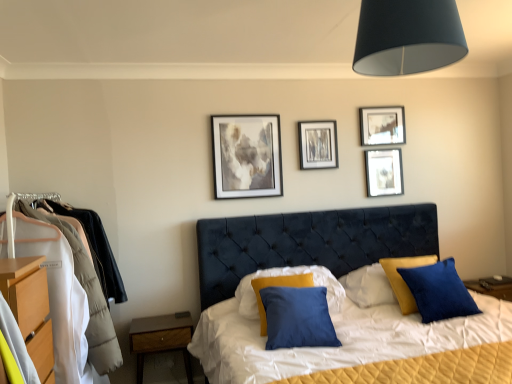
Question: Can you confirm if black matte lampshade at upper center is positioned to the left of matte silver picture frame at upper right, the 1th picture frame from the right?

Choices:
 (A) yes
 (B) no

Answer: (A)

Question: Does black matte lampshade at upper center lie in front of matte silver picture frame at upper right, the 1th picture frame from the right?

Choices:
 (A) no
 (B) yes

Answer: (B)

Question: Considering the relative sizes of black matte lampshade at upper center and matte silver picture frame at upper right, which is the fourth picture frame from left to right, in the image provided, is black matte lampshade at upper center smaller than matte silver picture frame at upper right, which is the fourth picture frame from left to right,?

Choices:
 (A) no
 (B) yes

Answer: (A)

Question: Is black matte lampshade at upper center thinner than matte silver picture frame at upper right, which is the fourth picture frame from left to right?

Choices:
 (A) yes
 (B) no

Answer: (B)

Question: Considering the relative sizes of black matte lampshade at upper center and matte silver picture frame at upper right, which is the fourth picture frame from left to right, in the image provided, is black matte lampshade at upper center bigger than matte silver picture frame at upper right, which is the fourth picture frame from left to right,?

Choices:
 (A) no
 (B) yes

Answer: (B)

Question: Can you confirm if black matte lampshade at upper center is shorter than matte silver picture frame at upper right, the 1th picture frame from the right?

Choices:
 (A) no
 (B) yes

Answer: (B)

Question: Would you say satin blue pillow at center, arranged as the 2th pillow when viewed from the right, is part of blue cotton pillow at center, the second pillow in the left-to-right sequence,'s contents?

Choices:
 (A) yes
 (B) no

Answer: (B)

Question: From a real-world perspective, is blue cotton pillow at center, which is the 1th pillow from right to left, under satin blue pillow at center, arranged as the 2th pillow when viewed from the right?

Choices:
 (A) yes
 (B) no

Answer: (A)

Question: Considering the relative positions of blue cotton pillow at center, which is the 1th pillow from right to left, and satin blue pillow at center, arranged as the 2th pillow when viewed from the right, in the image provided, is blue cotton pillow at center, which is the 1th pillow from right to left, to the right of satin blue pillow at center, arranged as the 2th pillow when viewed from the right, from the viewer's perspective?

Choices:
 (A) yes
 (B) no

Answer: (A)

Question: Is blue cotton pillow at center, which is the 1th pillow from right to left, in contact with satin blue pillow at center, arranged as the 2th pillow when viewed from the right?

Choices:
 (A) yes
 (B) no

Answer: (B)

Question: Considering the relative sizes of blue cotton pillow at center, which is the 1th pillow from right to left, and satin blue pillow at center, arranged as the 2th pillow when viewed from the right, in the image provided, is blue cotton pillow at center, which is the 1th pillow from right to left, thinner than satin blue pillow at center, arranged as the 2th pillow when viewed from the right,?

Choices:
 (A) yes
 (B) no

Answer: (A)

Question: Does blue cotton pillow at center, which is the 1th pillow from right to left, have a larger size compared to satin blue pillow at center, which appears as the 1th pillow when viewed from the left?

Choices:
 (A) yes
 (B) no

Answer: (B)

Question: Is blue cotton pillow at center, the second pillow in the left-to-right sequence, bigger than matte black picture frame at upper right, acting as the second picture frame starting from the right?

Choices:
 (A) no
 (B) yes

Answer: (B)